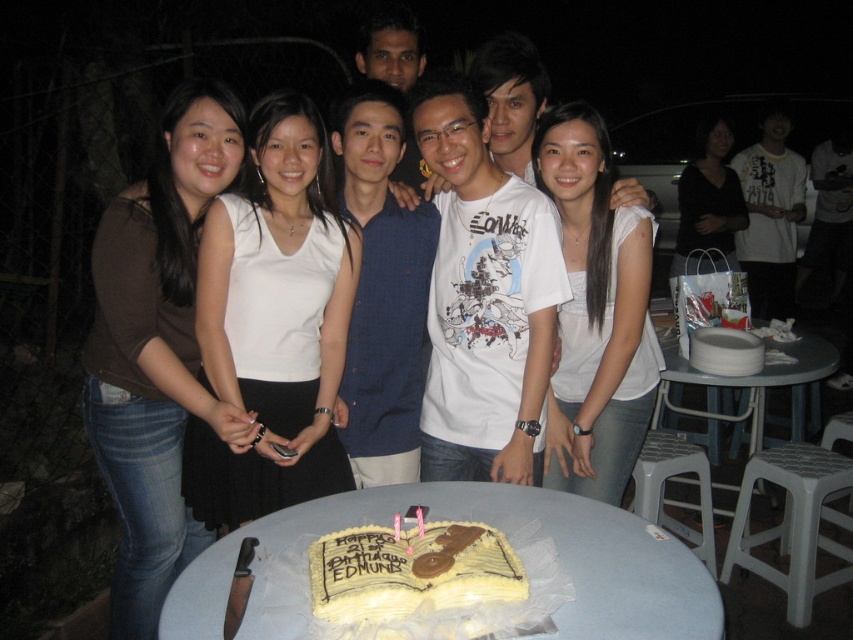
You are standing at the center of the round table where the birthday celebration is happening. There are two points marked on the tablecloth. One is at coordinate point (579, 289) and the other is at point (851, 518). If you want to move from the first point to the second point, which direction should you move relative to the table?

To move from point (579, 289) to point (851, 518), you should move towards the direction away from the cake since point (579, 289) is in front of point (851, 518). This means the second point is behind the first one relative to your position at the table center.

You are a photographer at the event and need to ensure that both the white matte tank top at center and the brown fabric shirt at left are in focus simultaneously. Given that your camera has a depth of field that can cover 20 centimeters, will you be able to achieve this?

The distance between the white matte tank top at center and the brown fabric shirt at left is 18.28 centimeters, which is within the camera depth of field of 20 centimeters. Therefore, both subjects will be in focus.

In the scene shown: You are attending a birthday party and need to decide which of the two shirts, the white matte tank top at center or the brown fabric shirt at left, would be more comfortable for a long evening. Based on their thickness, which one might be less likely to cause overheating?

The white matte tank top at center is thinner than the brown fabric shirt at left, so it would be less likely to cause overheating due to its lighter material.